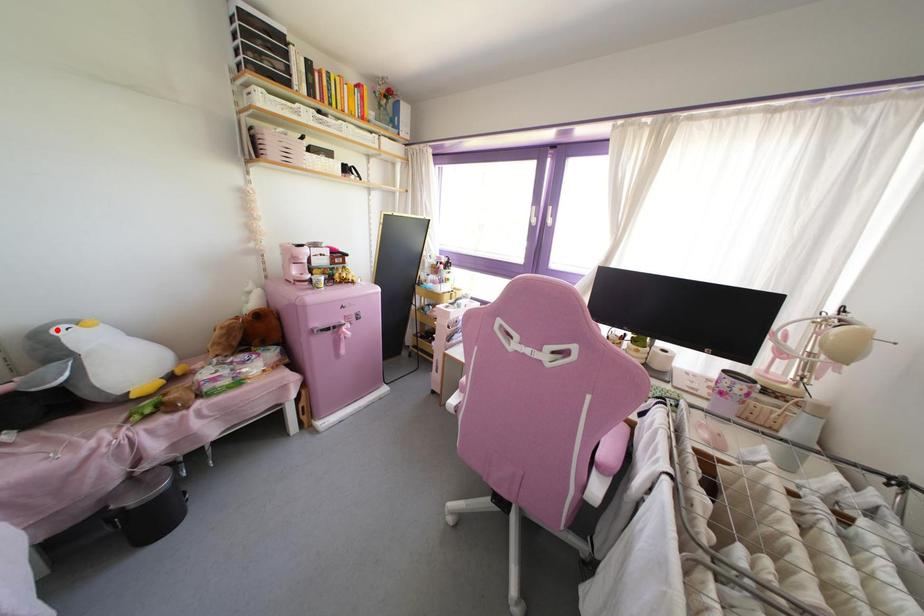
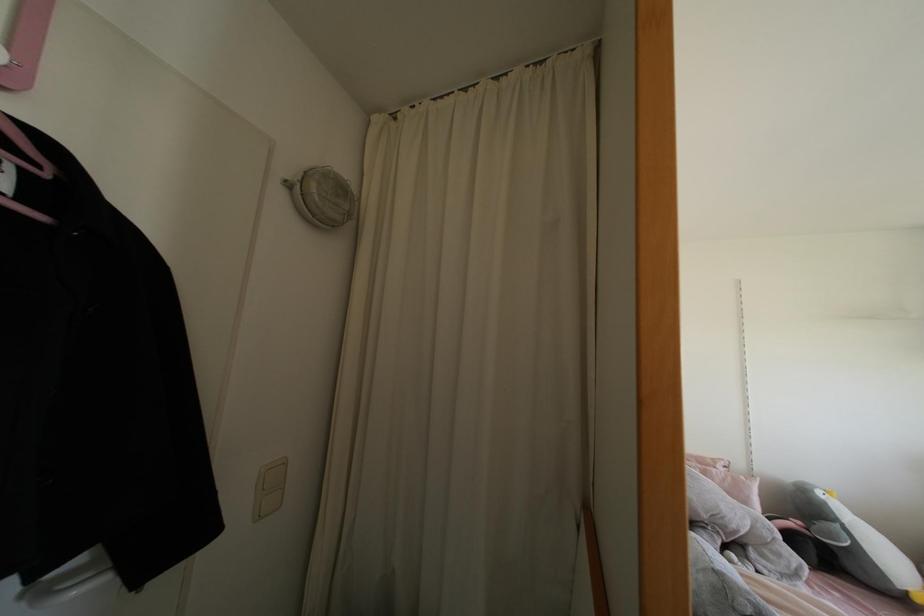
Question: I am providing you with two images of the same scene from different viewpoints. A red point is shown in image1. For the corresponding object point in image2, is it positioned nearer or farther from the camera?

Choices:
 (A) Nearer
 (B) Farther

Answer: (A)